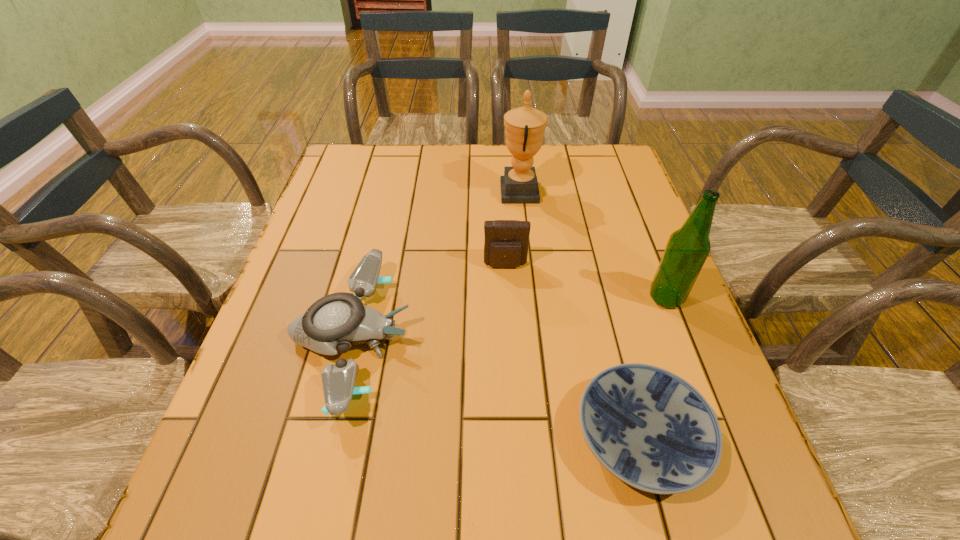
The width and height of the screenshot is (960, 540). Identify the location of award. (525, 126).

Image resolution: width=960 pixels, height=540 pixels. In order to click on beer bottle in this screenshot , I will do `click(687, 249)`.

At what (x,y) coordinates should I click in order to perform the action: click on the third tallest object. Please return your answer as a coordinate pair (x, y). The width and height of the screenshot is (960, 540). Looking at the image, I should click on (506, 243).

The image size is (960, 540). In order to click on drone in this screenshot , I will do `click(333, 323)`.

Find the location of a particular element. The height and width of the screenshot is (540, 960). the leftmost object is located at coordinates (333, 323).

Where is `plate`? plate is located at coordinates (653, 430).

Locate an element on the screen. This screenshot has height=540, width=960. vacant space located at the front of the award with handles is located at coordinates (374, 192).

You are a GUI agent. You are given a task and a screenshot of the screen. Output one action in this format:
    pyautogui.click(x=<x>, y=<y>)
    Task: Click on the free point located at the front of the award with handles
    The image size is (960, 540).
    Given the screenshot: What is the action you would take?
    pyautogui.click(x=364, y=192)

Locate an element on the screen. vacant region located 0.290m at the front of the award with handles is located at coordinates (401, 192).

Find the location of `free region located on the label of the beer bottle`. free region located on the label of the beer bottle is located at coordinates (499, 298).